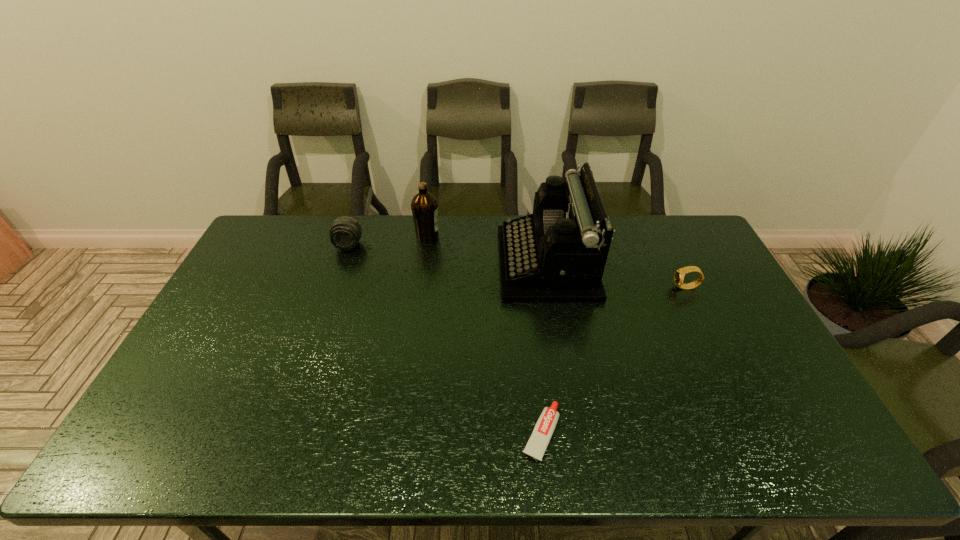
This screenshot has height=540, width=960. I want to click on free space between the nearest object and the olive oil, so click(x=484, y=335).

Locate an element on the screen. free space between the typewriter and the fourth object from right to left is located at coordinates (487, 249).

Where is `free space between the typewriter and the nearest object`? The image size is (960, 540). free space between the typewriter and the nearest object is located at coordinates (544, 348).

I want to click on free space between the olive oil and the leftmost object, so click(388, 241).

Identify the location of object that can be found as the fourth closest to the fourth shortest object. (679, 275).

Identify which object is the closest to the leftmost object. Please provide its 2D coordinates. Your answer should be formatted as a tuple, i.e. [(x, y)], where the tuple contains the x and y coordinates of a point satisfying the conditions above.

[(424, 206)]

This screenshot has width=960, height=540. Find the location of `free space that satisfies the following two spatial constraints: 1. on the label of the nearest object; 2. on the right side of the olive oil`. free space that satisfies the following two spatial constraints: 1. on the label of the nearest object; 2. on the right side of the olive oil is located at coordinates (399, 433).

Identify the location of vacant region that satisfies the following two spatial constraints: 1. on the label of the nearest object; 2. on the left side of the second object from left to right. This screenshot has height=540, width=960. (399, 433).

Locate an element on the screen. The image size is (960, 540). vacant area in the image that satisfies the following two spatial constraints: 1. on the back side of the nearest object; 2. on the label of the second tallest object is located at coordinates (519, 236).

This screenshot has height=540, width=960. In order to click on blank area in the image that satisfies the following two spatial constraints: 1. at the front element of the third tallest object; 2. on the left side of the shortest object in this screenshot , I will do `click(283, 433)`.